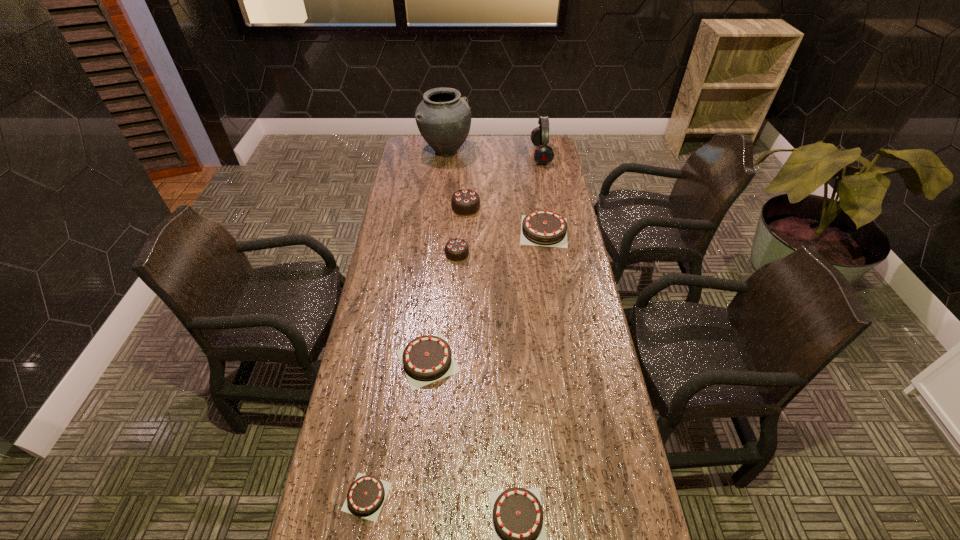
Find the location of a particular element. the third shortest chocolate cake is located at coordinates (426, 359).

This screenshot has height=540, width=960. Identify the location of the shortest object. (366, 495).

In order to click on the shortest chocolate cake in this screenshot , I will do `click(366, 495)`.

Locate an element on the screen. This screenshot has height=540, width=960. vacant space located on the front of the black urn is located at coordinates (440, 212).

This screenshot has width=960, height=540. In order to click on free space located 0.320m on the ear cups of the seventh shortest object in this screenshot , I will do `click(465, 154)`.

Find the location of `vacant space located 0.370m on the ear cups of the seventh shortest object`. vacant space located 0.370m on the ear cups of the seventh shortest object is located at coordinates (455, 154).

Identify the location of vacant space located 0.270m on the ear cups of the seventh shortest object. The image size is (960, 540). (475, 154).

You are a GUI agent. You are given a task and a screenshot of the screen. Output one action in this format:
    pyautogui.click(x=<x>, y=<y>)
    Task: Click on the vacant region located 0.370m on the right of the third tallest object
    Image resolution: width=960 pixels, height=540 pixels.
    Given the screenshot: What is the action you would take?
    569,207

Locate an element on the screen. The height and width of the screenshot is (540, 960). free space located on the back of the nearer chocolate chocolate cake is located at coordinates (459, 213).

Locate an element on the screen. The width and height of the screenshot is (960, 540). blank space located on the back of the farthest brown chocolate cake is located at coordinates (540, 201).